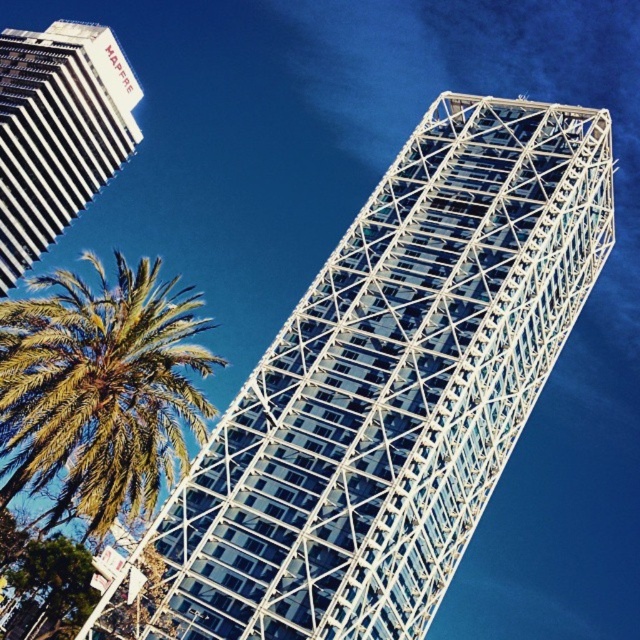
Question: Which of the following is the closest to the observer?

Choices:
 (A) (8, 248)
 (B) (500, 132)
 (C) (198, 323)

Answer: (B)

Question: Which object is the farthest from the white striped building at upper left?

Choices:
 (A) white glass tower at center
 (B) green leafy palm tree at lower left

Answer: (A)

Question: Which object is farther from the camera taking this photo?

Choices:
 (A) white glass tower at center
 (B) white striped building at upper left

Answer: (B)

Question: Does green leafy palm tree at lower left appear under white striped building at upper left?

Choices:
 (A) no
 (B) yes

Answer: (B)

Question: Is white glass tower at center behind green leafy palm tree at lower left?

Choices:
 (A) yes
 (B) no

Answer: (A)

Question: Does green leafy palm tree at lower left have a smaller size compared to white striped building at upper left?

Choices:
 (A) no
 (B) yes

Answer: (A)